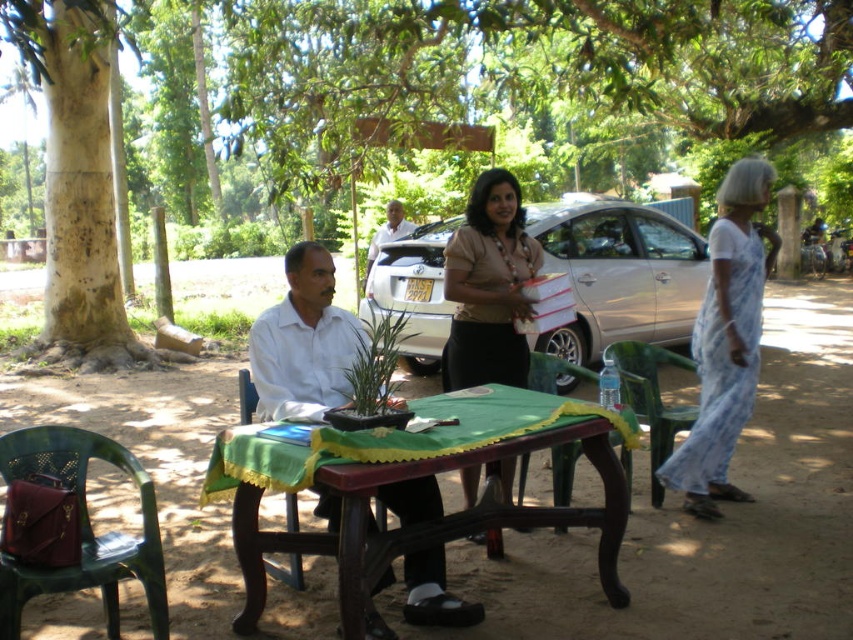
You are planning to set up a picnic table in this outdoor area. The picnic table requires a space that is wider than the green plastic chair at lower right. Is the area near the green leafy tree at center suitable for placing the picnic table?

The green leafy tree at center is wider than the green plastic chair at lower right, so the area near the green leafy tree at center has enough width to accommodate the picnic table requiring space wider than the green plastic chair at lower right.

You are sitting on the green plastic chair at lower right and want to look at the green leafy tree at center. Can you see it without moving your head?

Yes, because the green leafy tree at center is in front of the green plastic chair at lower right, so it should be directly visible from your seated position.